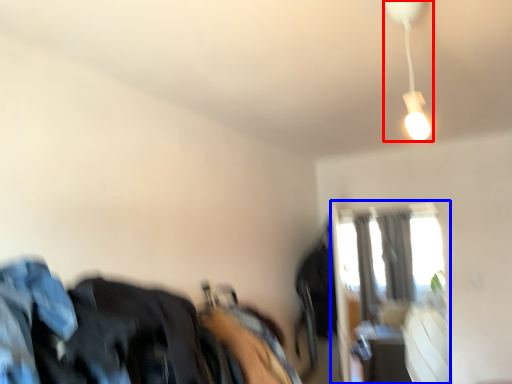
Question: Which object is closer to the camera taking this photo, lamp (highlighted by a red box) or window (highlighted by a blue box)?

Choices:
 (A) lamp
 (B) window

Answer: (A)